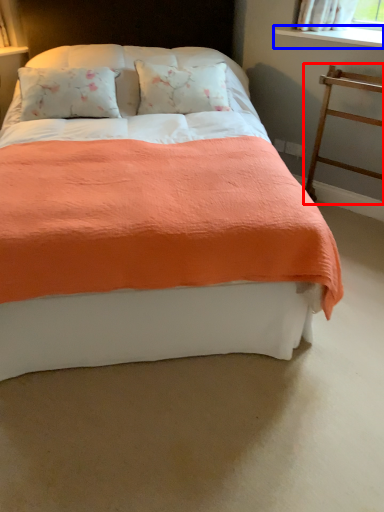
Question: Among these objects, which one is farthest to the camera, balustrade (highlighted by a red box) or window sill (highlighted by a blue box)?

Choices:
 (A) balustrade
 (B) window sill

Answer: (B)